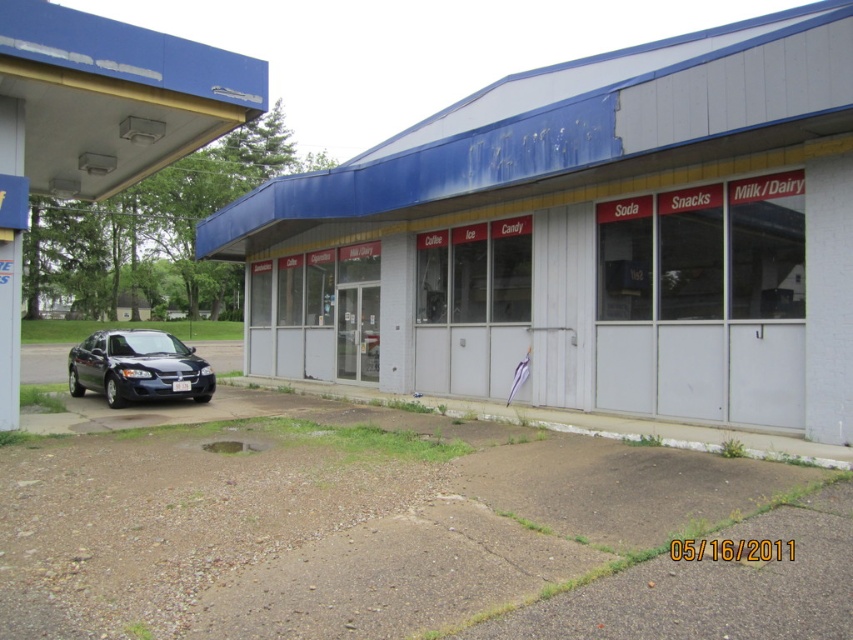
In the scene shown: You are standing in front of the convenience store and want to take a photo of the white textured building at center and the shiny black sedan at lower left. Which object should you focus on first to ensure both are in clear view?

You should focus on the white textured building at center first because it is closer to the viewer than the shiny black sedan at lower left, so adjusting focus from near to far will help both be in clear view.

You are a delivery driver who needs to park your truck next to the shiny black sedan at lower left. The truck is wider than the sedan. Based on the scene, can you park your truck without overlapping the white textured building at center?

The white textured building at center is thinner than the shiny black sedan at lower left. Since the truck is wider than the sedan, it would likely be wider than the building. However, the building is located at the center, so parking the truck next to the sedan might require checking the available space between them and the building. If the distance between the sedan and the building is sufficient to accommodate the truck without overlapping, then it should be possible. However, without exact measurements,

You are a delivery driver who needs to park your truck, which is 4 meters long, between the white textured building at center and the metallic blue gas station at left. Is there enough space for your truck to fit between them?

The white textured building at center is 4.65 meters away from the metallic blue gas station at left. Since the truck is 4 meters long, there is sufficient space between the two structures to accommodate the truck.